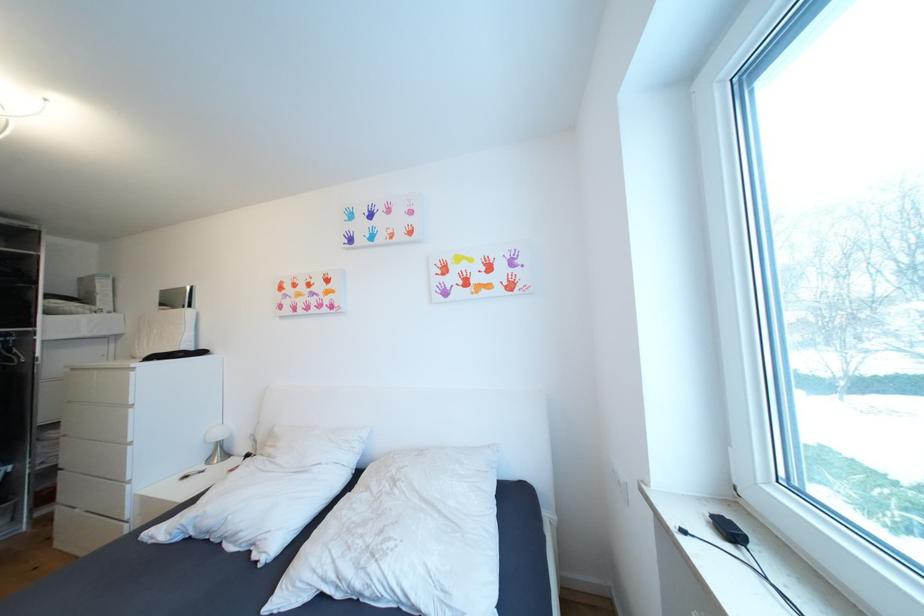
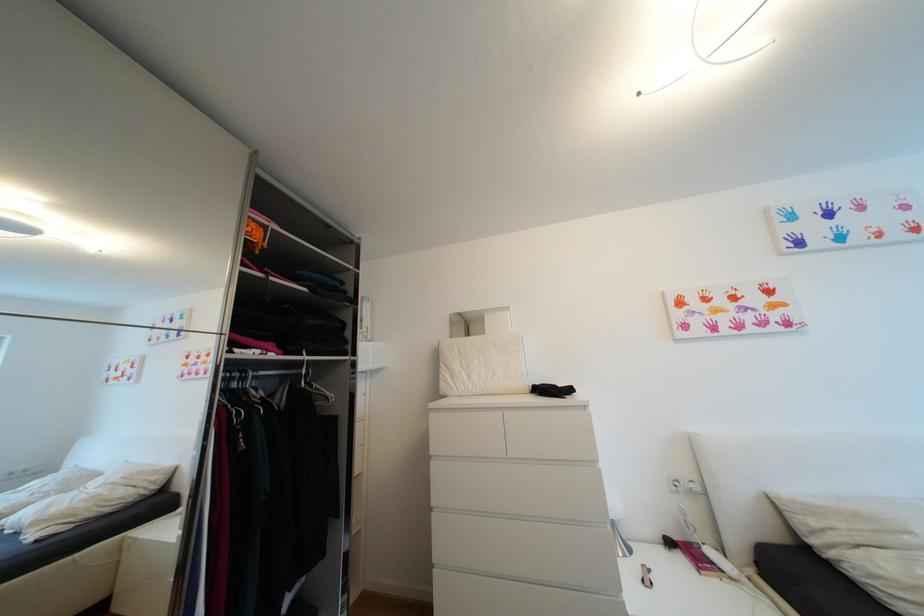
Question: The images are taken continuously from a first-person perspective. In which direction are you moving?

Choices:
 (A) Left
 (B) Right
 (C) Forward
 (D) Backward

Answer: (A)